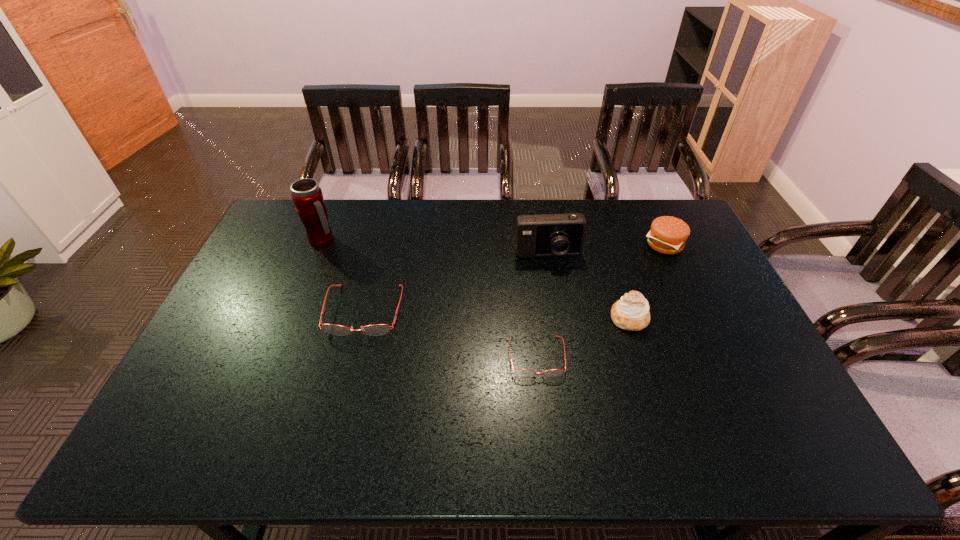
You are a GUI agent. You are given a task and a screenshot of the screen. Output one action in this format:
    pyautogui.click(x=<x>, y=<y>)
    Task: Click on the free spot between the leftmost object and the rightmost object
    This screenshot has width=960, height=540.
    Given the screenshot: What is the action you would take?
    pyautogui.click(x=493, y=242)

I want to click on vacant space that's between the right spectacles and the taller spectacles, so click(x=450, y=334).

Identify the location of unoccupied position between the hamburger and the fifth object from left to right. The image size is (960, 540). [647, 281].

Identify the location of empty location between the shortest object and the pastry. The height and width of the screenshot is (540, 960). (583, 337).

Locate an element on the screen. This screenshot has width=960, height=540. vacant space in between the pastry and the second shortest object is located at coordinates coord(496,314).

At what (x,y) coordinates should I click in order to perform the action: click on empty space that is in between the second tallest object and the pastry. Please return your answer as a coordinate pair (x, y). This screenshot has width=960, height=540. Looking at the image, I should click on (588, 287).

The width and height of the screenshot is (960, 540). Identify the location of object that can be found as the second closest to the shortest object. (549, 235).

Choose which object is the third nearest neighbor to the fifth shortest object. Please provide its 2D coordinates. Your answer should be formatted as a tuple, i.e. [(x, y)], where the tuple contains the x and y coordinates of a point satisfying the conditions above.

[(523, 372)]

Where is `blank area in the image that satisfies the following two spatial constraints: 1. on the lenses of the left spectacles; 2. on the right side of the fifth object from left to right`? blank area in the image that satisfies the following two spatial constraints: 1. on the lenses of the left spectacles; 2. on the right side of the fifth object from left to right is located at coordinates (363, 318).

This screenshot has width=960, height=540. I want to click on free space in the image that satisfies the following two spatial constraints: 1. on the side with the handle of the thermos bottle; 2. on the right side of the rightmost object, so click(321, 245).